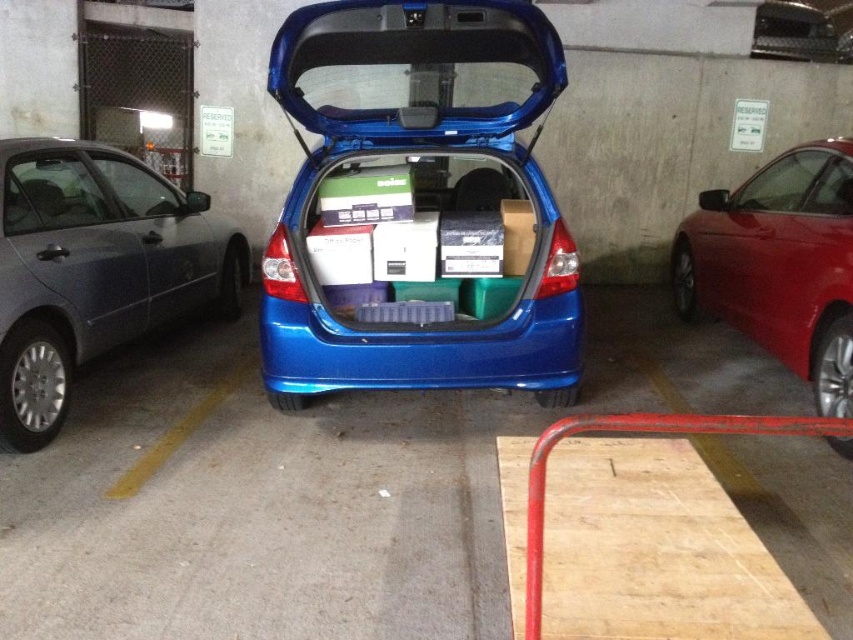
Question: Can you confirm if shiny red sedan at right is thinner than metallic silver car at center?

Choices:
 (A) yes
 (B) no

Answer: (A)

Question: Is matte gray sedan at left to the right of metallic silver car at center from the viewer's perspective?

Choices:
 (A) yes
 (B) no

Answer: (B)

Question: Which point is farther from the camera taking this photo?

Choices:
 (A) (85, 292)
 (B) (791, 289)
 (C) (772, 6)

Answer: (C)

Question: Among these objects, which one is nearest to the camera?

Choices:
 (A) metallic silver car at center
 (B) matte gray sedan at left

Answer: (B)

Question: Among these points, which one is nearest to the camera?

Choices:
 (A) (766, 28)
 (B) (1, 368)
 (C) (270, 76)
 (D) (786, 236)

Answer: (B)

Question: Can you confirm if blue glossy hatchback at center is positioned to the left of matte gray sedan at left?

Choices:
 (A) no
 (B) yes

Answer: (A)